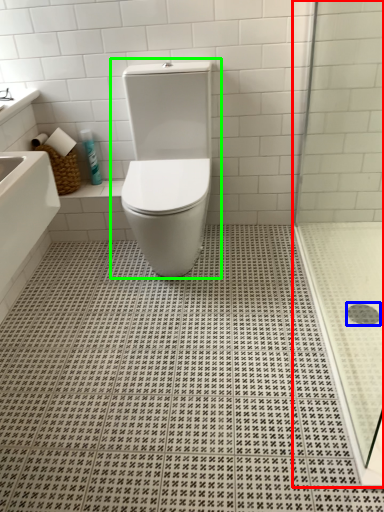
Question: Estimate the real-world distances between objects in this image. Which object is closer to shower door (highlighted by a red box), drain (highlighted by a blue box) or toilet (highlighted by a green box)?

Choices:
 (A) drain
 (B) toilet

Answer: (B)